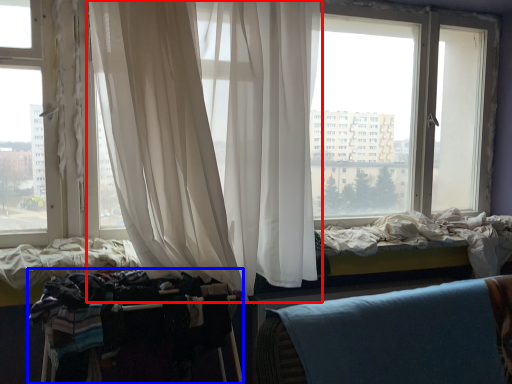
Question: Among these objects, which one is farthest to the camera, curtain (highlighted by a red box) or baby carriage (highlighted by a blue box)?

Choices:
 (A) curtain
 (B) baby carriage

Answer: (B)